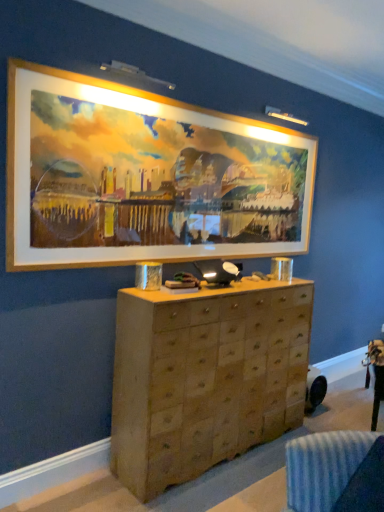
Question: Is wooden chest of drawers at center in front of or behind wooden frame at upper center in the image?

Choices:
 (A) front
 (B) behind

Answer: (B)

Question: Considering the relative positions of wooden chest of drawers at center and wooden frame at upper center in the image provided, is wooden chest of drawers at center to the left or to the right of wooden frame at upper center?

Choices:
 (A) left
 (B) right

Answer: (B)

Question: In terms of height, does wooden chest of drawers at center look taller or shorter compared to wooden frame at upper center?

Choices:
 (A) short
 (B) tall

Answer: (B)

Question: Choose the correct answer: Is wooden frame at upper center inside wooden chest of drawers at center or outside it?

Choices:
 (A) inside
 (B) outside

Answer: (B)

Question: In terms of width, does wooden frame at upper center look wider or thinner when compared to wooden chest of drawers at center?

Choices:
 (A) wide
 (B) thin

Answer: (B)

Question: Is wooden frame at upper center to the left or to the right of wooden chest of drawers at center in the image?

Choices:
 (A) right
 (B) left

Answer: (B)

Question: In terms of height, does wooden frame at upper center look taller or shorter compared to wooden chest of drawers at center?

Choices:
 (A) short
 (B) tall

Answer: (A)